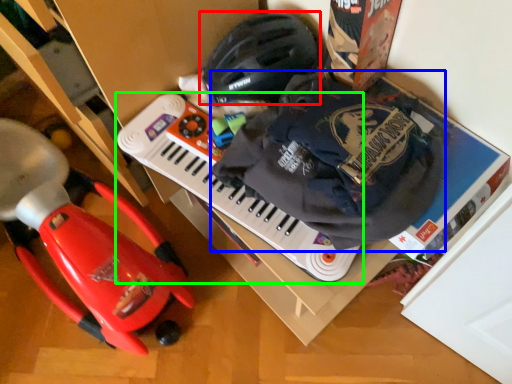
Question: Based on their relative distances, which object is nearer to helmet (highlighted by a red box)? Choose from waste (highlighted by a blue box) and musical keyboard (highlighted by a green box).

Choices:
 (A) waste
 (B) musical keyboard

Answer: (B)